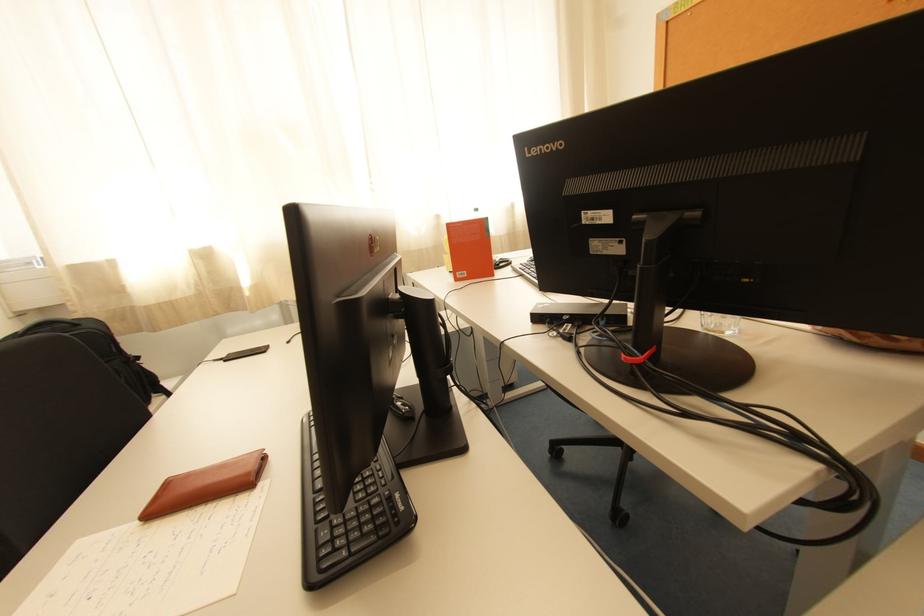
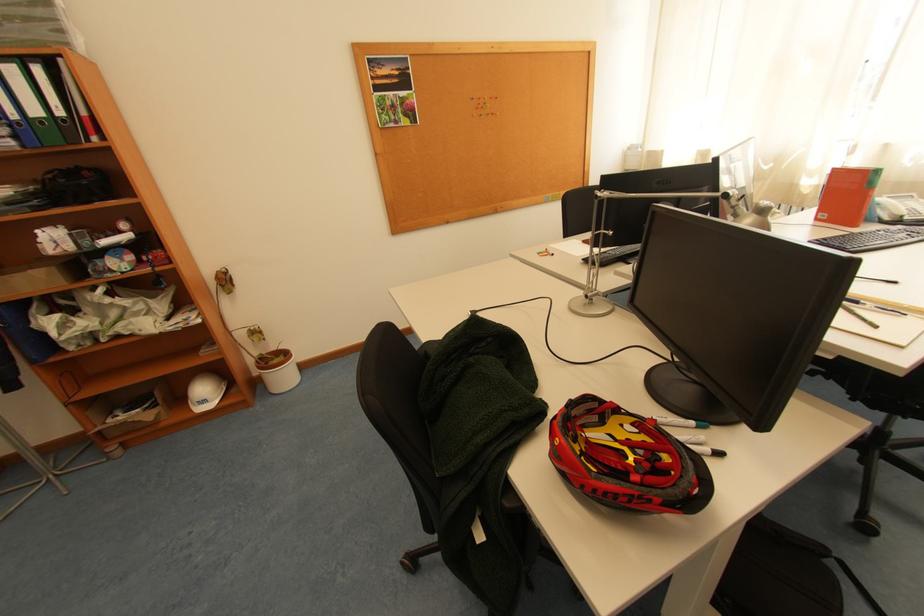
Locate, in the second image, the point that corresponds to pixel 465 281 in the first image.

(824, 220)